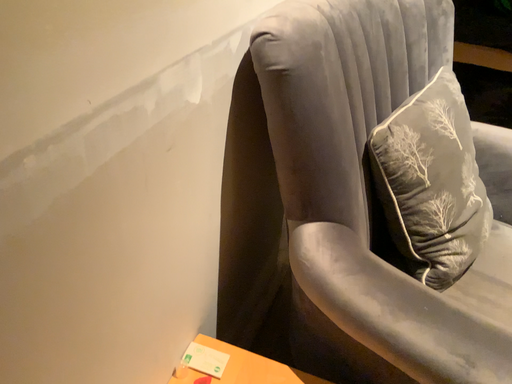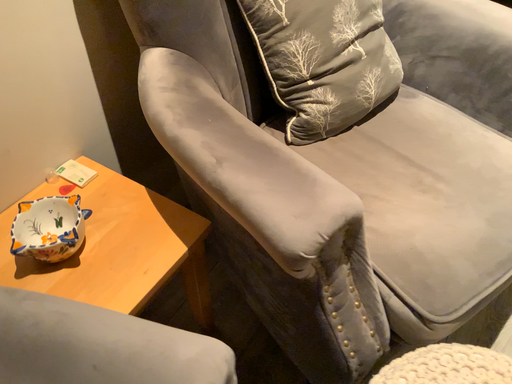
Question: Which way did the camera rotate in the video?

Choices:
 (A) rotated left
 (B) rotated right

Answer: (A)